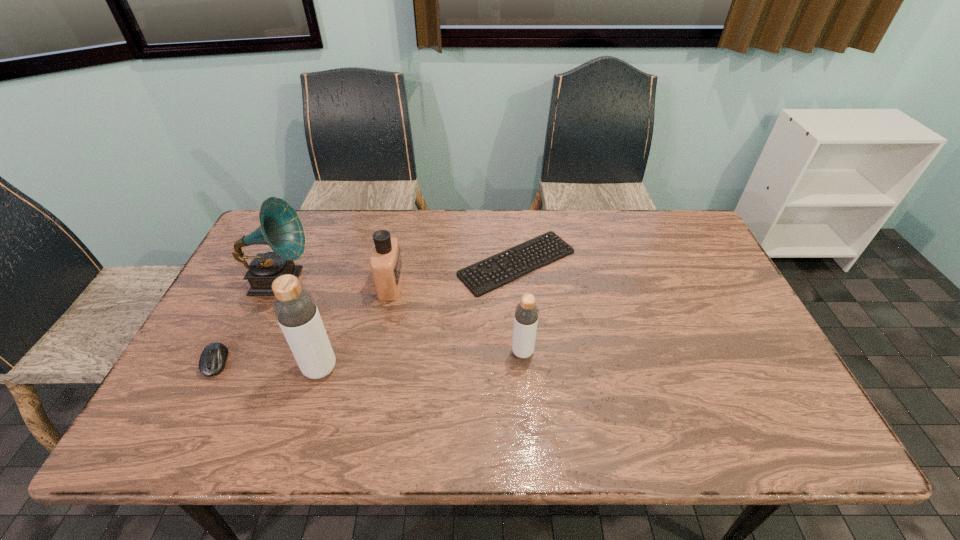
Identify the location of vacant area between the taller bottle and the mouse. (268, 366).

At what (x,y) coordinates should I click in order to perform the action: click on vacant region between the fourth object from right to left and the fifth tallest object. Please return your answer as a coordinate pair (x, y). Looking at the image, I should click on (268, 366).

Locate which object is the second closest to the second shortest object. Please provide its 2D coordinates. Your answer should be formatted as a tuple, i.e. [(x, y)], where the tuple contains the x and y coordinates of a point satisfying the conditions above.

[(294, 307)]

You are a GUI agent. You are given a task and a screenshot of the screen. Output one action in this format:
    pyautogui.click(x=<x>, y=<y>)
    Task: Click on the object identified as the third closest to the second shortest object
    The image size is (960, 540).
    Given the screenshot: What is the action you would take?
    pyautogui.click(x=386, y=265)

Find the location of a particular element. free space that satisfies the following two spatial constraints: 1. on the back side of the right bottle; 2. on the left side of the computer keyboard is located at coordinates (516, 263).

You are a GUI agent. You are given a task and a screenshot of the screen. Output one action in this format:
    pyautogui.click(x=<x>, y=<y>)
    Task: Click on the free space that satisfies the following two spatial constraints: 1. from the horn of the phonograph_record; 2. on the left side of the right bottle
    This screenshot has height=540, width=960.
    Given the screenshot: What is the action you would take?
    pyautogui.click(x=248, y=352)

Identify the location of free spot that satisfies the following two spatial constraints: 1. on the back side of the shorter bottle; 2. from the horn of the phonograph_record. (516, 281).

I want to click on free space that satisfies the following two spatial constraints: 1. from the horn of the phonograph_record; 2. on the left side of the shorter bottle, so click(248, 352).

What are the coordinates of `free region that satisfies the following two spatial constraints: 1. from the horn of the right bottle; 2. on the left side of the phonograph_record` in the screenshot? It's located at (248, 352).

You are a GUI agent. You are given a task and a screenshot of the screen. Output one action in this format:
    pyautogui.click(x=<x>, y=<y>)
    Task: Click on the free space that satisfies the following two spatial constraints: 1. on the front side of the shortest object; 2. from the horn of the phonograph_record
    
    Given the screenshot: What is the action you would take?
    pyautogui.click(x=518, y=281)